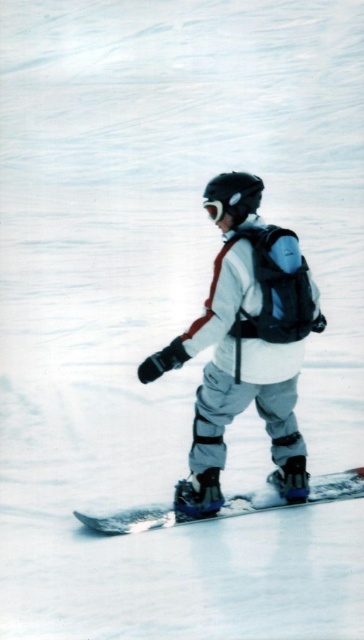
Question: Which point is farther to the camera?

Choices:
 (A) (254, 184)
 (B) (266, 316)
 (C) (121, 524)

Answer: (C)

Question: Estimate the real-world distances between objects in this image. Which object is farther from the white plastic snowboard at center?

Choices:
 (A) white matte goggles at center
 (B) white matte snowboarder at center

Answer: (A)

Question: Can you confirm if white plastic snowboard at center is bigger than white matte goggles at center?

Choices:
 (A) no
 (B) yes

Answer: (B)

Question: Which object appears farthest from the camera in this image?

Choices:
 (A) white matte goggles at center
 (B) white plastic snowboard at center

Answer: (B)

Question: Is white matte snowboarder at center positioned before white matte goggles at center?

Choices:
 (A) yes
 (B) no

Answer: (A)

Question: Is white matte snowboarder at center further to the viewer compared to white plastic snowboard at center?

Choices:
 (A) no
 (B) yes

Answer: (A)